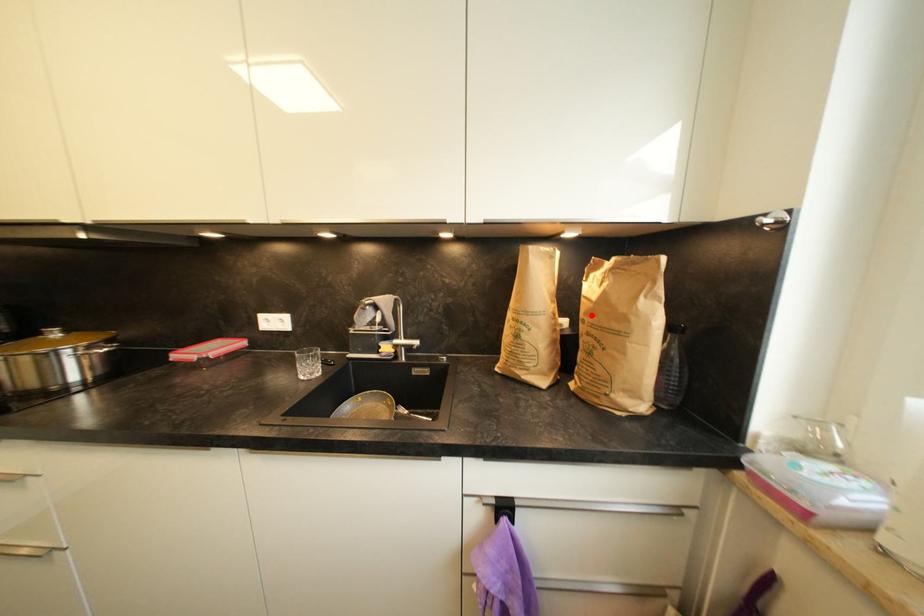
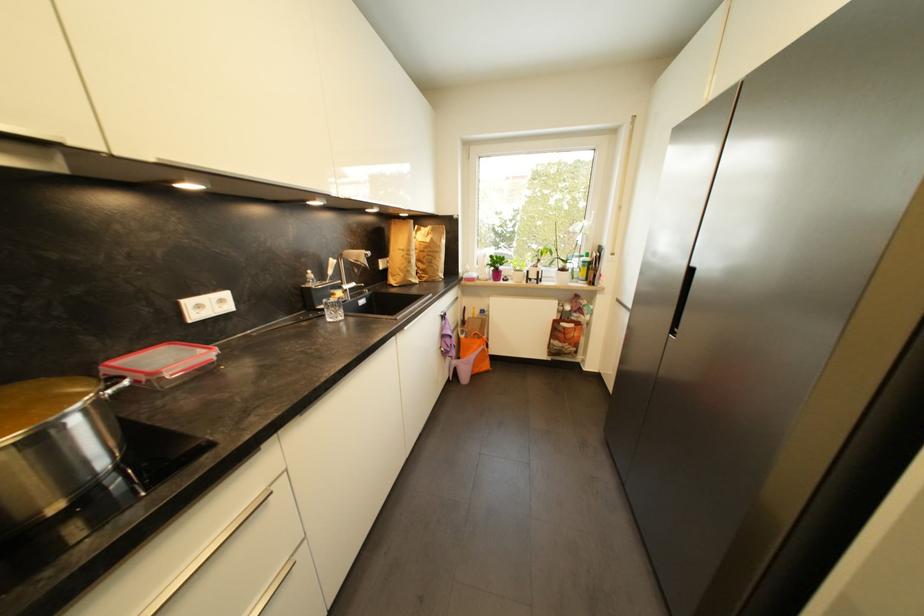
Find the pixel in the second image that matches the highlighted location in the first image.

(430, 249)